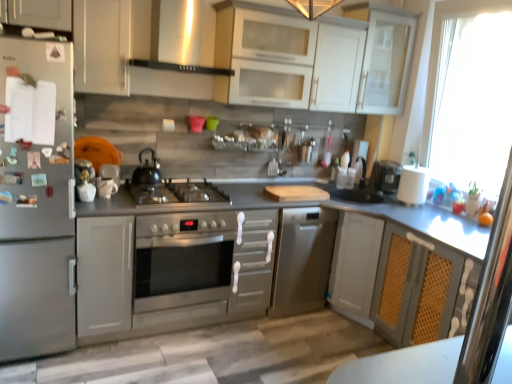
Question: Does transparent glass window at right have a lesser height compared to transparent glass cabinet at upper right?

Choices:
 (A) yes
 (B) no

Answer: (B)

Question: Considering the relative sizes of transparent glass window at right and transparent glass cabinet at upper right in the image provided, is transparent glass window at right bigger than transparent glass cabinet at upper right?

Choices:
 (A) no
 (B) yes

Answer: (B)

Question: Can you confirm if transparent glass window at right is positioned to the left of transparent glass cabinet at upper right?

Choices:
 (A) yes
 (B) no

Answer: (B)

Question: Does transparent glass window at right turn towards transparent glass cabinet at upper right?

Choices:
 (A) no
 (B) yes

Answer: (A)

Question: Can you confirm if transparent glass window at right is smaller than transparent glass cabinet at upper right?

Choices:
 (A) yes
 (B) no

Answer: (B)

Question: Considering their positions, is clear glass screen door at right located in front of or behind transparent glass window at right?

Choices:
 (A) front
 (B) behind

Answer: (A)

Question: In terms of height, does clear glass screen door at right look taller or shorter compared to transparent glass window at right?

Choices:
 (A) short
 (B) tall

Answer: (A)

Question: Is clear glass screen door at right wider or thinner than transparent glass window at right?

Choices:
 (A) wide
 (B) thin

Answer: (B)

Question: Is point (481, 306) closer or farther from the camera than point (452, 59)?

Choices:
 (A) closer
 (B) farther

Answer: (A)

Question: Considering the positions of stainless steel oven at center and white glossy cabinet at upper center, positioned as the first cabinetry in right-to-left order, in the image, is stainless steel oven at center bigger or smaller than white glossy cabinet at upper center, positioned as the first cabinetry in right-to-left order,?

Choices:
 (A) small
 (B) big

Answer: (B)

Question: From the image's perspective, is stainless steel oven at center above or below white glossy cabinet at upper center, positioned as the first cabinetry in right-to-left order?

Choices:
 (A) below
 (B) above

Answer: (A)

Question: Relative to white glossy cabinet at upper center, positioned as the first cabinetry in right-to-left order, is stainless steel oven at center in front or behind?

Choices:
 (A) front
 (B) behind

Answer: (A)

Question: Is stainless steel oven at center taller or shorter than white glossy cabinet at upper center, which appears as the third cabinetry when viewed from the left?

Choices:
 (A) tall
 (B) short

Answer: (A)

Question: In the image, is black matte kettle at center on the left side or the right side of white matte paper towel at right?

Choices:
 (A) right
 (B) left

Answer: (B)

Question: Is black matte kettle at center wider or thinner than white matte paper towel at right?

Choices:
 (A) thin
 (B) wide

Answer: (A)